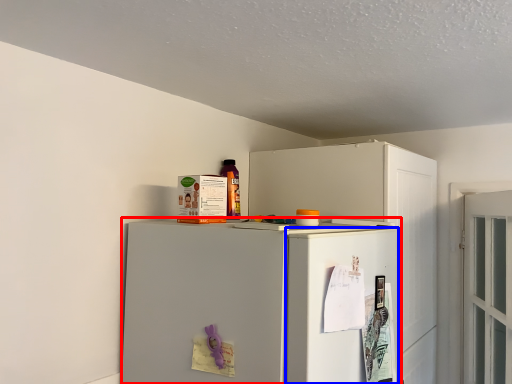
Question: Which of the following is the farthest to the observer, refrigerator (highlighted by a red box) or door (highlighted by a blue box)?

Choices:
 (A) refrigerator
 (B) door

Answer: (B)